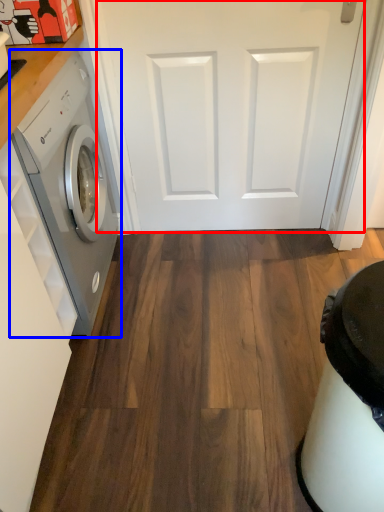
Question: Among these objects, which one is farthest to the camera, door (highlighted by a red box) or washing machine (highlighted by a blue box)?

Choices:
 (A) door
 (B) washing machine

Answer: (A)